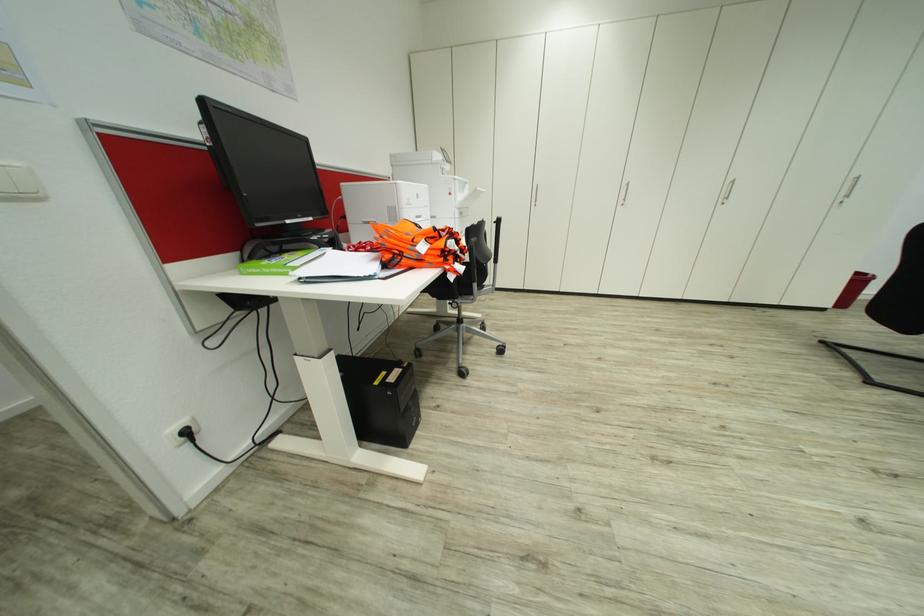
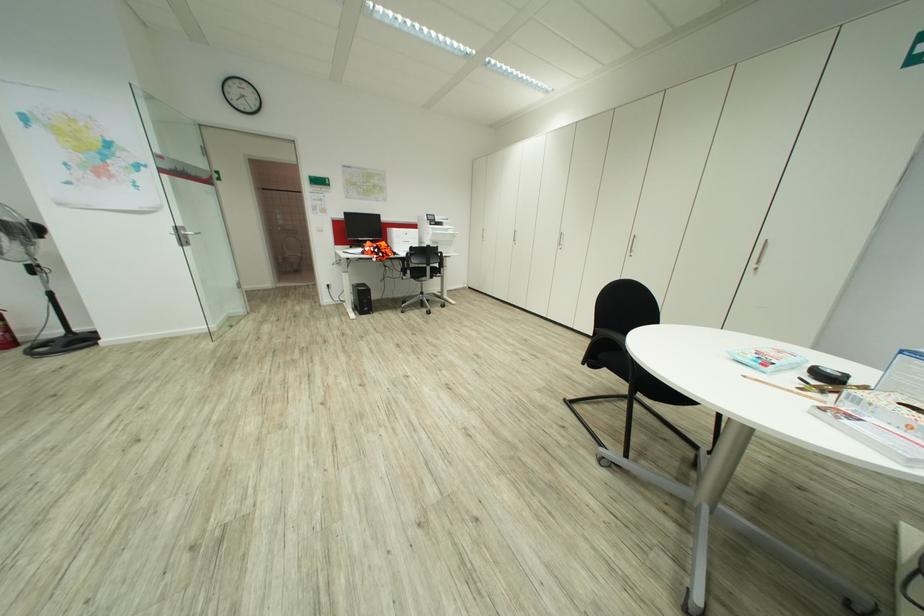
The point at [845,195] is marked in the first image. Where is the corresponding point in the second image?

(758, 262)